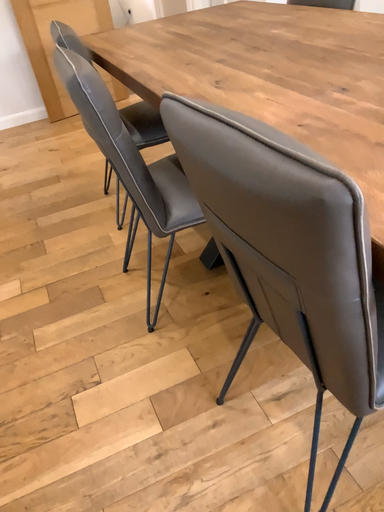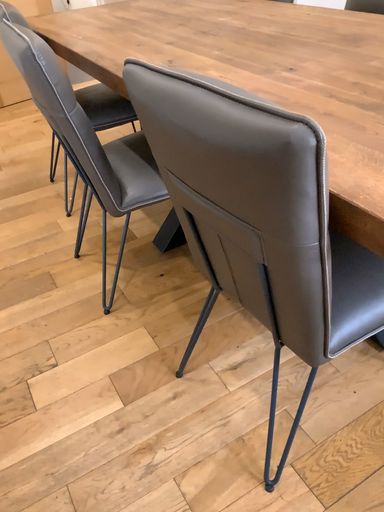
Question: How did the camera likely rotate when shooting the video?

Choices:
 (A) rotated left
 (B) rotated right

Answer: (B)